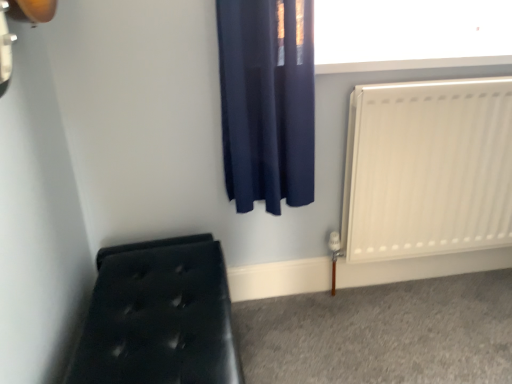
At what (x,y) coordinates should I click in order to perform the action: click on vacant space in front of white matte radiator at right. Please return your answer as a coordinate pair (x, y). Looking at the image, I should click on (446, 332).